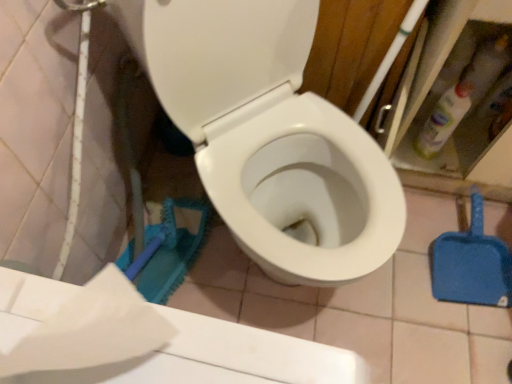
Question: In terms of width, does blue plastic shovel at lower right look wider or thinner when compared to white glossy toilet at center?

Choices:
 (A) wide
 (B) thin

Answer: (B)

Question: From a real-world perspective, is blue plastic shovel at lower right above or below white glossy toilet at center?

Choices:
 (A) below
 (B) above

Answer: (A)

Question: Considering the real-world distances, which object is farthest from the white glossy toilet at center?

Choices:
 (A) white matte toilet paper at lower left
 (B) translucent plastic bottle at upper right
 (C) blue plastic shovel at lower right

Answer: (A)

Question: Which of these objects is positioned farthest from the white matte toilet paper at lower left?

Choices:
 (A) white glossy toilet at center
 (B) blue plastic shovel at lower right
 (C) translucent plastic bottle at upper right

Answer: (B)